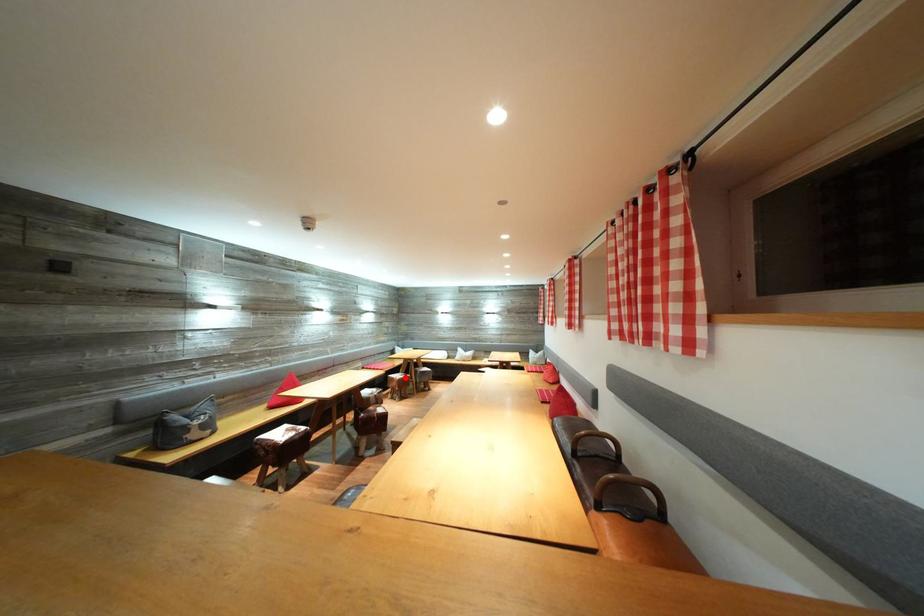
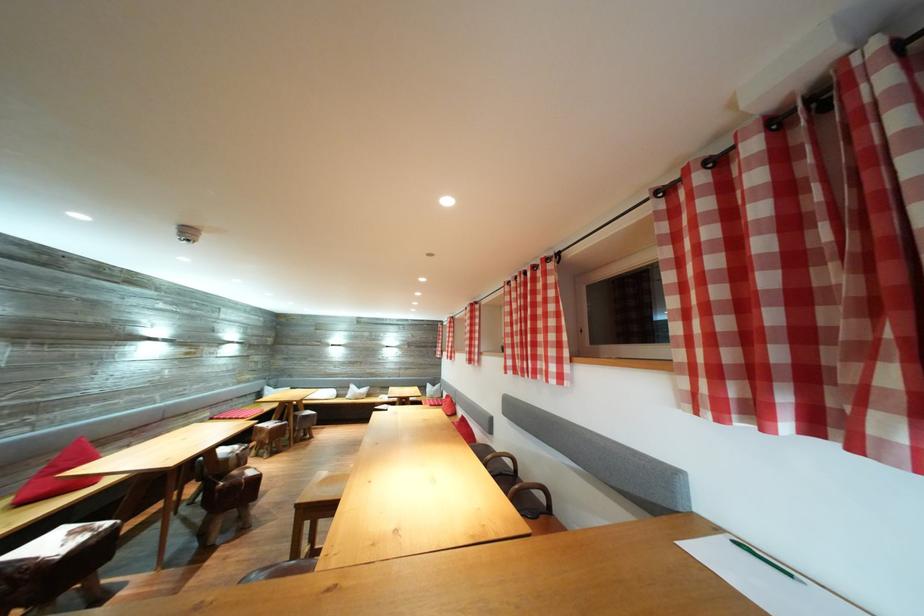
Question: I am providing you with two images of the same scene from different viewpoints. Image1 has a red point marked. In image2, the corresponding 3D location appears at what relative position? Reply with the corresponding letter.

Choices:
 (A) Closer
 (B) Farther

Answer: (A)